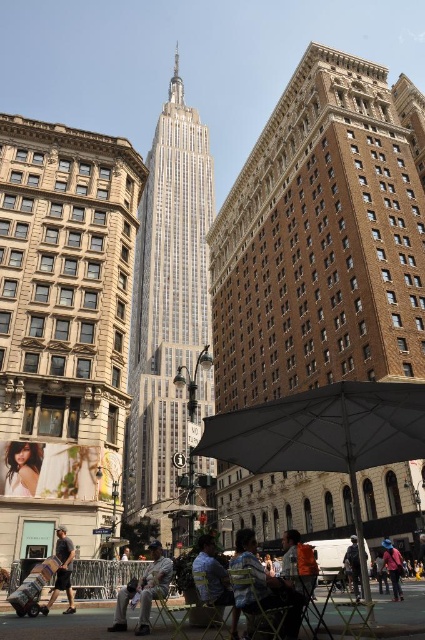
Question: Is light gray fabric jacket at lower center to the right of denim jacket at lower right from the viewer's perspective?

Choices:
 (A) yes
 (B) no

Answer: (B)

Question: Can you confirm if light gray fabric jacket at lower center is positioned to the right of orange fabric chair at lower center?

Choices:
 (A) no
 (B) yes

Answer: (A)

Question: Among these points, which one is nearest to the camera?

Choices:
 (A) (161, 582)
 (B) (380, 548)
 (C) (288, 554)
 (D) (241, 547)

Answer: (D)

Question: Can you confirm if camouflage-patterned shirt at center is positioned to the left of orange fabric chair at lower center?

Choices:
 (A) yes
 (B) no

Answer: (A)

Question: Among these points, which one is farthest from the camera?

Choices:
 (A) (357, 560)
 (B) (410, 413)

Answer: (A)

Question: Among these objects, which one is farthest from the camera?

Choices:
 (A) orange fabric chair at lower center
 (B) denim jacket at lower right
 (C) smooth white shirt at lower left

Answer: (B)